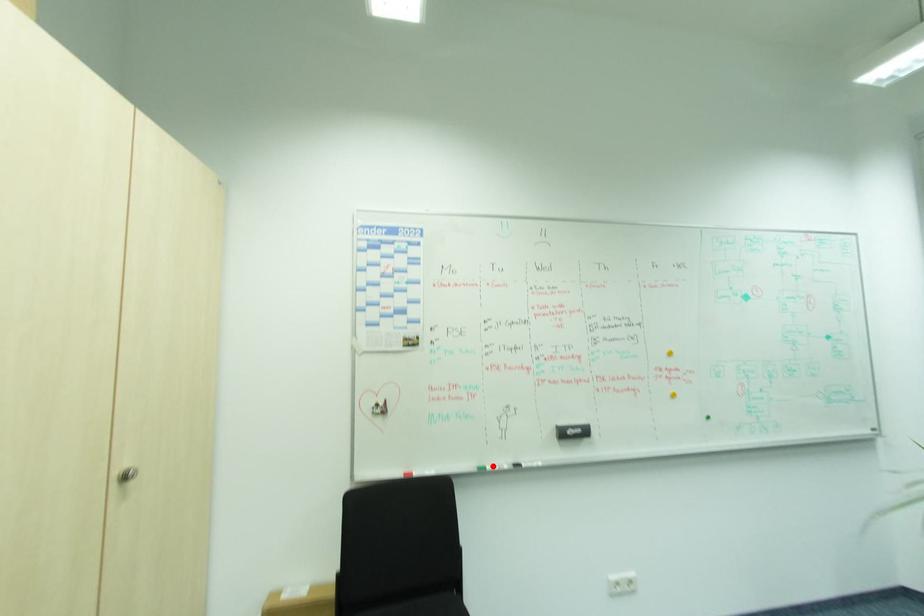
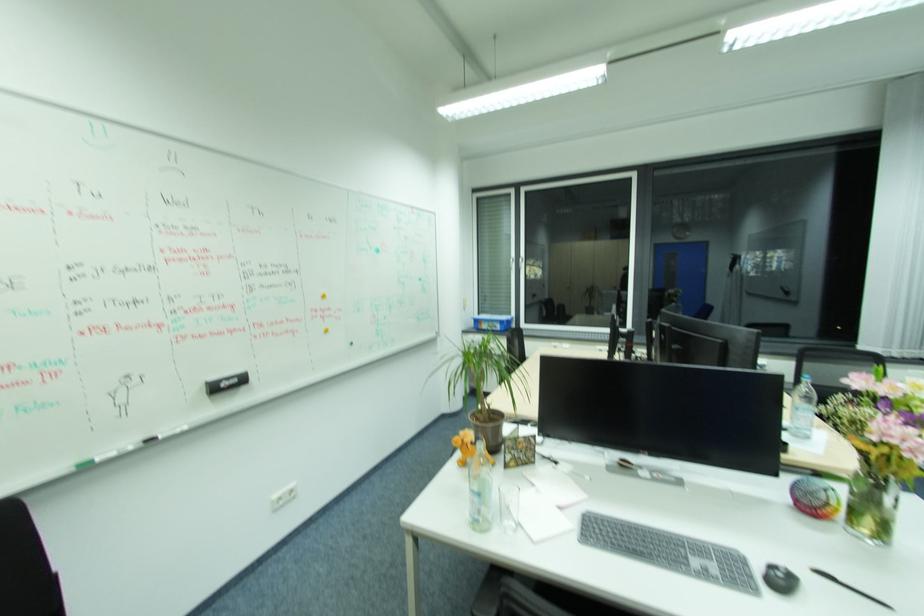
The point at the highlighted location is marked in the first image. Where is the corresponding point in the second image?

(105, 460)